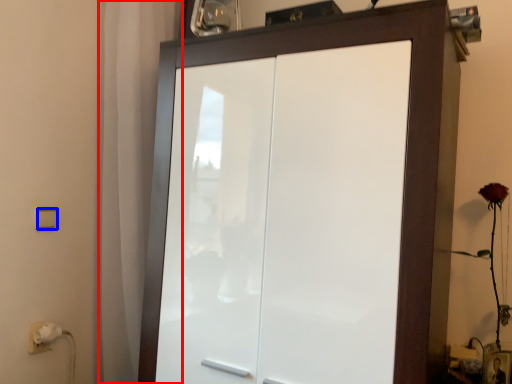
Question: Which object is closer to the camera taking this photo, curtain (highlighted by a red box) or light switch (highlighted by a blue box)?

Choices:
 (A) curtain
 (B) light switch

Answer: (B)